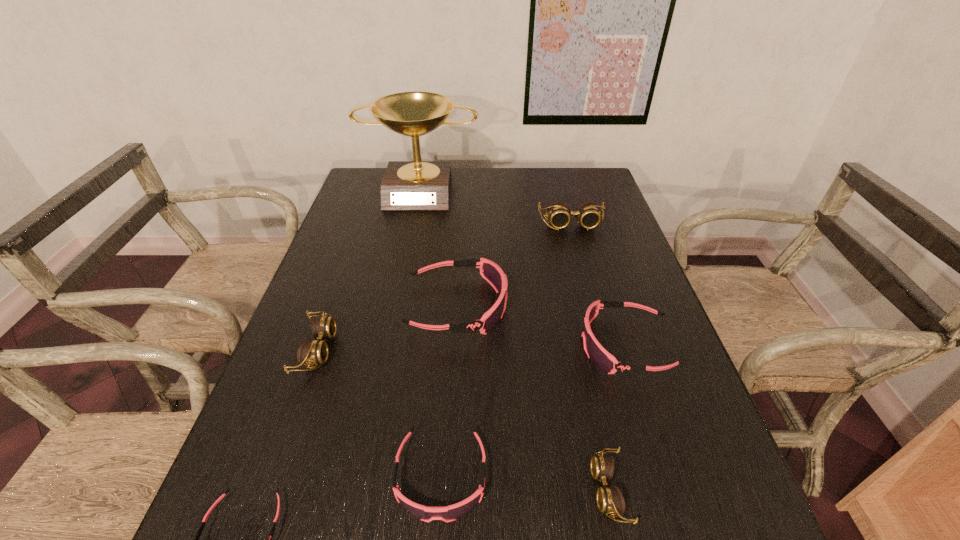
Where is `blank region between the rightmost pink goggles and the third biggest pink goggles`? The height and width of the screenshot is (540, 960). blank region between the rightmost pink goggles and the third biggest pink goggles is located at coordinates coord(534,411).

Image resolution: width=960 pixels, height=540 pixels. Find the location of `free area in between the seventh nearest object and the third biggest pink goggles`. free area in between the seventh nearest object and the third biggest pink goggles is located at coordinates (506, 350).

The height and width of the screenshot is (540, 960). What are the coordinates of `vacant space in between the award and the third biggest pink goggles` in the screenshot? It's located at (431, 333).

This screenshot has height=540, width=960. In order to click on free point between the smallest brown goggles and the rightmost pink goggles in this screenshot , I will do coord(617,417).

Where is `vacant area that lies between the second biggest pink goggles and the farthest brown goggles`? This screenshot has width=960, height=540. vacant area that lies between the second biggest pink goggles and the farthest brown goggles is located at coordinates (598, 285).

Where is `free space between the biggest pink goggles and the leftmost brown goggles`? The image size is (960, 540). free space between the biggest pink goggles and the leftmost brown goggles is located at coordinates (387, 328).

This screenshot has width=960, height=540. I want to click on object that is the closest to the second farthest brown goggles, so click(x=491, y=272).

Locate which object is the seventh closest to the nearest brown goggles. Please provide its 2D coordinates. Your answer should be formatted as a tuple, i.e. [(x, y)], where the tuple contains the x and y coordinates of a point satisfying the conditions above.

[(407, 185)]

Point out which goggles is positioned as the nearest to the farthest brown goggles. Please provide its 2D coordinates. Your answer should be formatted as a tuple, i.e. [(x, y)], where the tuple contains the x and y coordinates of a point satisfying the conditions above.

[(491, 272)]

Find the location of a particular element. This screenshot has height=540, width=960. the fourth closest goggles to the rightmost pink goggles is located at coordinates (587, 214).